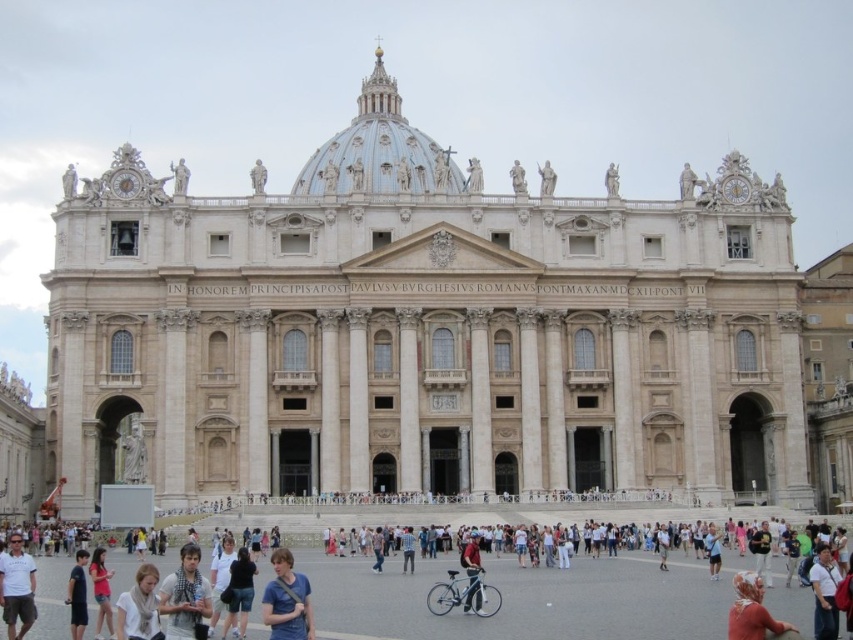
In the scene shown: You are standing in front of the cathedral and notice a light beige scarf at lower left and a white cotton shirt at lower right. Which item is closer to you?

The light beige scarf at lower left is closer to you since it is in front of the white cotton shirt at lower right.

You are standing in front of the grand classical building and want to determine the relative positions of two points marked on its facade. Specifically, you need to know which of the two points, point (175,588) or point (155,596), is closer to you. Can you help determine this?

Point (175,588) is closer to you because it is further to the viewer than point (155,596), meaning it appears nearer in the image.